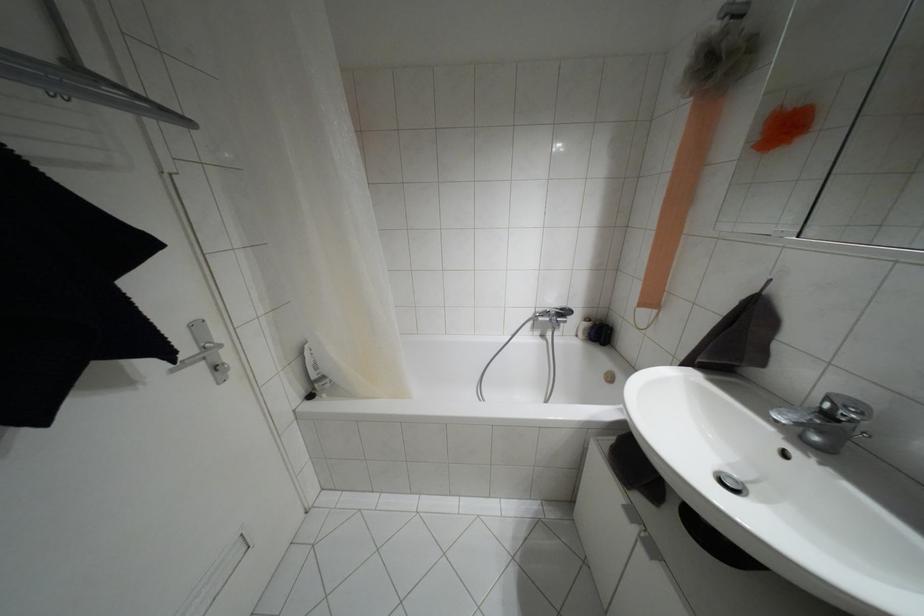
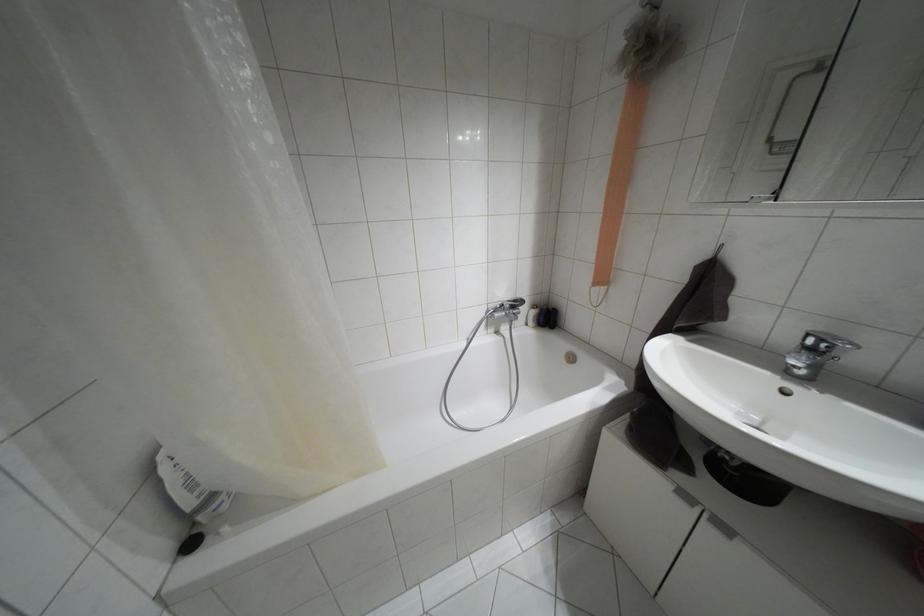
Find the pixel in the second image that matches pixel 600 333 in the first image.

(546, 317)